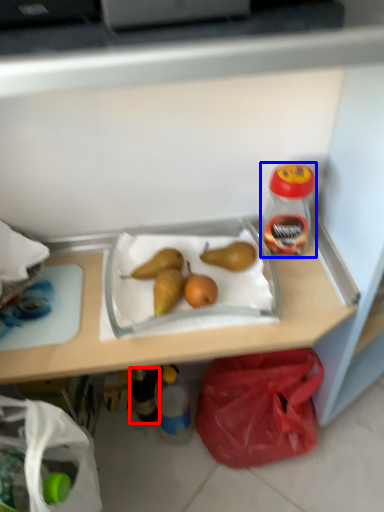
Question: Which object appears closest to the camera in this image, bottle (highlighted by a red box) or bottle (highlighted by a blue box)?

Choices:
 (A) bottle
 (B) bottle

Answer: (B)